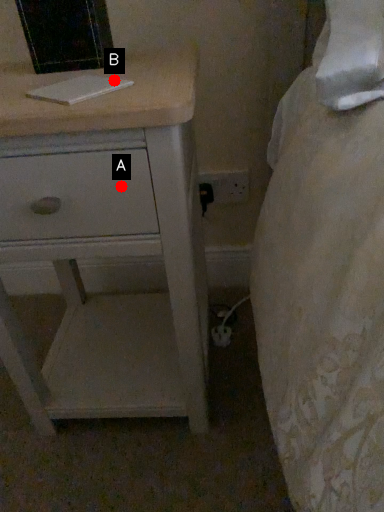
Question: Two points are circled on the image, labeled by A and B beside each circle. Which point is farther to the camera?

Choices:
 (A) A is further
 (B) B is further

Answer: (B)